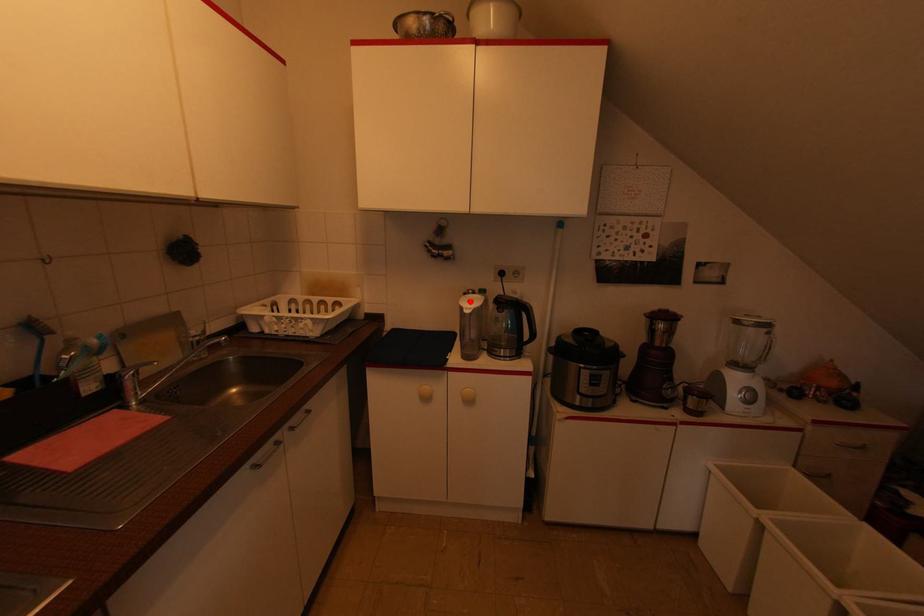
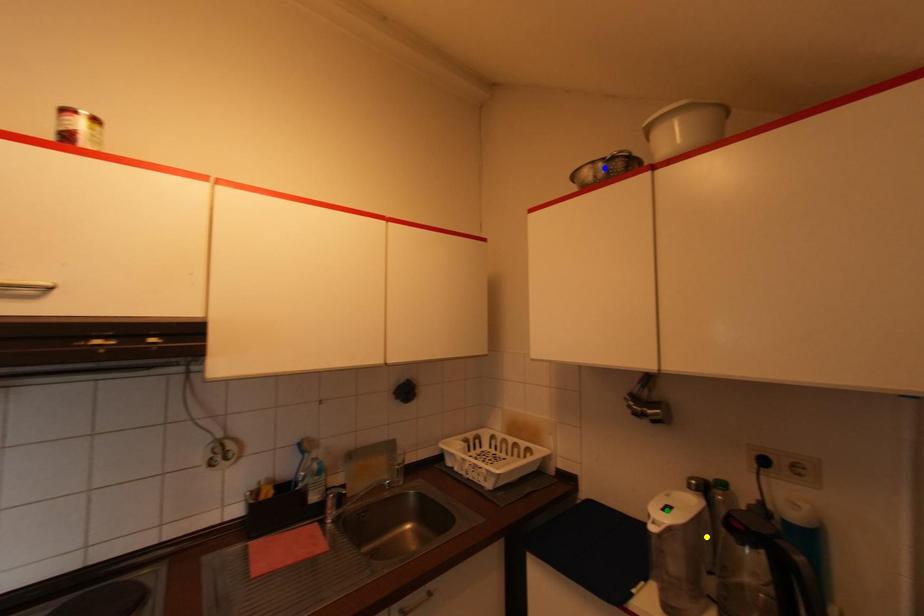
Question: I am providing you with two images of the same scene from different viewpoints. A red point is marked on the first image. You are given multiple points on the second image. Which point in image 2 represents the same 3d spot as the red point in image 1?

Choices:
 (A) green point
 (B) yellow point
 (C) blue point

Answer: (A)